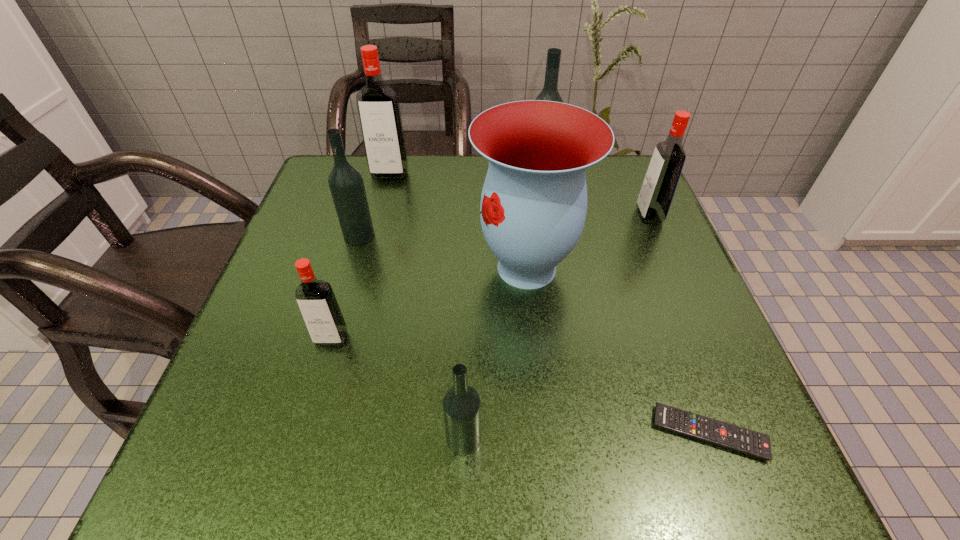
The image size is (960, 540). I want to click on free region located on the front and back of the nearest red vodka, so click(x=317, y=390).

Identify the location of free space located 0.100m on the right of the third vodka from right to left. (x=550, y=438).

The height and width of the screenshot is (540, 960). Identify the location of free space located 0.300m on the back of the remote control. (647, 266).

Locate an element on the screen. vodka at the near edge is located at coordinates (461, 404).

This screenshot has height=540, width=960. Identify the location of remote control present at the near edge. (732, 437).

At what (x,y) coordinates should I click in order to perform the action: click on vodka that is positioned at the right edge. Please return your answer as a coordinate pair (x, y). This screenshot has width=960, height=540. Looking at the image, I should click on (660, 182).

You are a GUI agent. You are given a task and a screenshot of the screen. Output one action in this format:
    pyautogui.click(x=<x>, y=<y>)
    Task: Click on the remote control that is positioned at the right edge
    
    Given the screenshot: What is the action you would take?
    (x=732, y=437)

The height and width of the screenshot is (540, 960). What are the coordinates of `object positioned at the far left corner` in the screenshot? It's located at (378, 107).

The height and width of the screenshot is (540, 960). I want to click on object present at the far right corner, so click(660, 182).

Identify the location of object located at the near right corner. (732, 437).